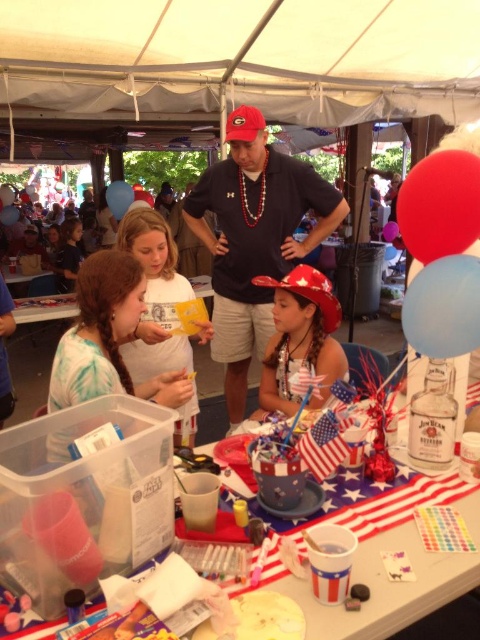
Can you confirm if rubber matte balloon at upper right is shorter than american flag-themed paper at center?

In fact, rubber matte balloon at upper right may be taller than american flag-themed paper at center.

Between rubber matte balloon at upper right and american flag-themed paper at center, which one is positioned higher?

rubber matte balloon at upper right

Does point (476, 227) come in front of point (387, 515)?

No, (476, 227) is behind (387, 515).

I want to click on rubber matte balloon at upper right, so click(440, 205).

Is shiny red cowboy hat at center taller than rubber matte balloon at upper right?

Yes.

Who is shorter, shiny red cowboy hat at center or rubber matte balloon at upper right?

rubber matte balloon at upper right

Describe the element at coordinates (300, 339) in the screenshot. I see `shiny red cowboy hat at center` at that location.

This screenshot has height=640, width=480. I want to click on shiny red cowboy hat at center, so click(300, 339).

How distant is matte black shirt at center from red matte baseball hat at center?

They are 17.43 inches apart.

Between point (232, 196) and point (325, 308), which one is positioned behind?

The point (232, 196) is behind.

Identify the location of matte black shirt at center. The width and height of the screenshot is (480, 640). (254, 244).